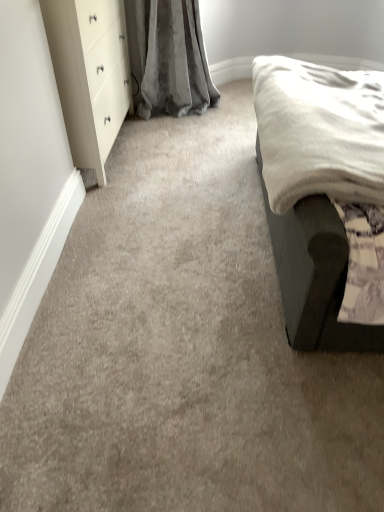
Question: From the image's perspective, is white glossy dresser at upper left located above or below dark gray fabric bed at right?

Choices:
 (A) below
 (B) above

Answer: (B)

Question: In terms of height, does white glossy dresser at upper left look taller or shorter compared to dark gray fabric bed at right?

Choices:
 (A) tall
 (B) short

Answer: (B)

Question: Considering the positions of white glossy dresser at upper left and dark gray fabric bed at right in the image, is white glossy dresser at upper left wider or thinner than dark gray fabric bed at right?

Choices:
 (A) thin
 (B) wide

Answer: (A)

Question: From the image's perspective, is dark gray fabric bed at right located above or below white glossy dresser at upper left?

Choices:
 (A) above
 (B) below

Answer: (B)

Question: Would you say dark gray fabric bed at right is inside or outside white glossy dresser at upper left?

Choices:
 (A) inside
 (B) outside

Answer: (B)

Question: Based on their sizes in the image, would you say dark gray fabric bed at right is bigger or smaller than white glossy dresser at upper left?

Choices:
 (A) small
 (B) big

Answer: (B)

Question: From a real-world perspective, is dark gray fabric bed at right above or below white glossy dresser at upper left?

Choices:
 (A) below
 (B) above

Answer: (B)